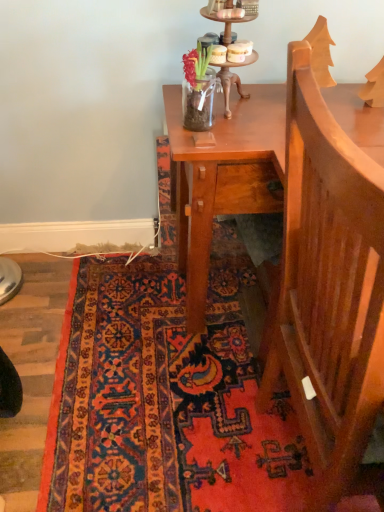
Find the location of a particular element. wooden candle holder at upper center is located at coordinates (233, 80).

The height and width of the screenshot is (512, 384). What do you see at coordinates (233, 80) in the screenshot?
I see `wooden candle holder at upper center` at bounding box center [233, 80].

Measure the distance between point (297, 280) and camera.

35.47 inches.

At what (x,y) coordinates should I click in order to perform the action: click on wooden candle holder at upper center. Please return your answer as a coordinate pair (x, y). The height and width of the screenshot is (512, 384). Looking at the image, I should click on (233, 80).

In the scene shown: Which of these two, wooden candle holder at upper center or wooden armchair at right, is wider?

With larger width is wooden armchair at right.

Looking at this image, which object is positioned more to the left, wooden candle holder at upper center or wooden armchair at right?

wooden candle holder at upper center is more to the left.

Are wooden candle holder at upper center and wooden armchair at right beside each other?

wooden candle holder at upper center and wooden armchair at right are clearly separated.

Based on the photo, does wooden candle holder at upper center have a larger size compared to wooden armchair at right?

No, wooden candle holder at upper center is not bigger than wooden armchair at right.

From a real-world perspective, which is physically above, carpet with intricate patterns at lower center or wooden armchair at right?

wooden armchair at right, from a real-world perspective.

Is the surface of carpet with intricate patterns at lower center in direct contact with wooden armchair at right?

No, carpet with intricate patterns at lower center is not with wooden armchair at right.

Is the position of carpet with intricate patterns at lower center less distant than that of wooden armchair at right?

That is False.

Looking at the image, does carpet with intricate patterns at lower center seem bigger or smaller compared to wooden armchair at right?

Considering their sizes, carpet with intricate patterns at lower center takes up less space than wooden armchair at right.

Can carpet with intricate patterns at lower center be found inside wooden candle holder at upper center?

Definitely not — carpet with intricate patterns at lower center is not inside wooden candle holder at upper center.

From a real-world perspective, is wooden candle holder at upper center physically located above or below carpet with intricate patterns at lower center?

wooden candle holder at upper center is above carpet with intricate patterns at lower center.

Which object is further away from the camera taking this photo, wooden candle holder at upper center or carpet with intricate patterns at lower center?

carpet with intricate patterns at lower center is further away from the camera.

Could you tell me if wooden candle holder at upper center is turned towards carpet with intricate patterns at lower center?

No, wooden candle holder at upper center is not facing towards carpet with intricate patterns at lower center.

Is wooden armchair at right smaller than wooden candle holder at upper center?

No.

Is wooden armchair at right positioned with its back to wooden candle holder at upper center?

No, wooden armchair at right is not facing the opposite direction of wooden candle holder at upper center.

Are wooden armchair at right and wooden candle holder at upper center making contact?

wooden armchair at right and wooden candle holder at upper center are clearly separated.

Is wooden armchair at right at the right side of wooden candle holder at upper center?

Correct, you'll find wooden armchair at right to the right of wooden candle holder at upper center.

How different are the orientations of wooden armchair at right and carpet with intricate patterns at lower center in degrees?

The facing directions of wooden armchair at right and carpet with intricate patterns at lower center are 88.3 degrees apart.

From a real-world perspective, who is located higher, wooden armchair at right or carpet with intricate patterns at lower center?

In real-world perspective, wooden armchair at right is above.

Where is `mat behind the wooden armchair at right`? mat behind the wooden armchair at right is located at coordinates (164, 401).

Can you confirm if wooden armchair at right is thinner than carpet with intricate patterns at lower center?

Indeed, wooden armchair at right has a lesser width compared to carpet with intricate patterns at lower center.

Which of these two, carpet with intricate patterns at lower center or wooden candle holder at upper center, is smaller?

Smaller between the two is wooden candle holder at upper center.

Consider the image. Is carpet with intricate patterns at lower center closer to camera compared to wooden candle holder at upper center?

No, it is not.

At what (x,y) coordinates should I click in order to perform the action: click on candle holder lying on the right of carpet with intricate patterns at lower center. Please return your answer as a coordinate pair (x, y). Looking at the image, I should click on (233, 80).

Is carpet with intricate patterns at lower center facing towards wooden candle holder at upper center?

No, carpet with intricate patterns at lower center does not turn towards wooden candle holder at upper center.

Image resolution: width=384 pixels, height=512 pixels. I want to click on armchair below the wooden candle holder at upper center (from the image's perspective), so click(x=315, y=276).

Locate an element on the screen. The height and width of the screenshot is (512, 384). armchair above the carpet with intricate patterns at lower center (from the image's perspective) is located at coordinates (315, 276).

From the image, which object appears to be farther from carpet with intricate patterns at lower center, wooden armchair at right or wooden candle holder at upper center?

wooden candle holder at upper center is further to carpet with intricate patterns at lower center.

Based on their spatial positions, is wooden candle holder at upper center or wooden armchair at right closer to carpet with intricate patterns at lower center?

Based on the image, wooden armchair at right appears to be nearer to carpet with intricate patterns at lower center.

From the picture: Looking at the image, which one is located closer to wooden candle holder at upper center, carpet with intricate patterns at lower center or wooden armchair at right?

The object closer to wooden candle holder at upper center is wooden armchair at right.

Looking at the image, which one is located further to wooden candle holder at upper center, wooden armchair at right or carpet with intricate patterns at lower center?

The object further to wooden candle holder at upper center is carpet with intricate patterns at lower center.

From the image, which object appears to be nearer to wooden armchair at right, wooden candle holder at upper center or carpet with intricate patterns at lower center?

carpet with intricate patterns at lower center lies closer to wooden armchair at right than the other object.

Consider the image. Estimate the real-world distances between objects in this image. Which object is further from wooden armchair at right, carpet with intricate patterns at lower center or wooden candle holder at upper center?

wooden candle holder at upper center lies further to wooden armchair at right than the other object.

Where is `armchair between wooden candle holder at upper center and carpet with intricate patterns at lower center in the up-down direction`? The image size is (384, 512). armchair between wooden candle holder at upper center and carpet with intricate patterns at lower center in the up-down direction is located at coordinates (315, 276).